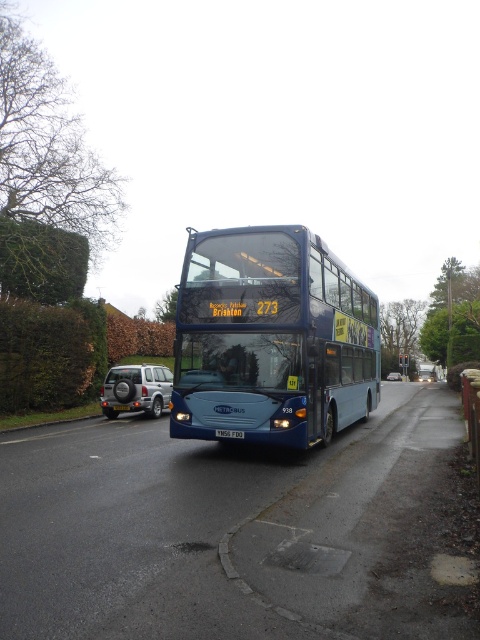
Looking at this image, you are a pedestrian standing on the sidewalk. You see a satin silver suv at center and a silver metallic car at center. Which vehicle is closer to you?

The satin silver suv at center is closer to you because the silver metallic car at center is behind it.

You are standing at the point with coordinates point (393, 380) and want to walk to the point (175, 346). Since the road is wet, you need to know if you can walk directly towards it without going into the road. Are the two points on the same side of the road?

The point (175, 346) is in front of point (393, 380), meaning they are likely on the same side of the road. Therefore, you can walk directly towards it without entering the road.

In the scene shown: You are a pedestrian standing at the edge of the road. You see the blue metallic bus at center and the silver metallic car at center. Which vehicle is closer to you?

The blue metallic bus at center is closer to you because it is located above the silver metallic car at center, indicating it is in front of the car.